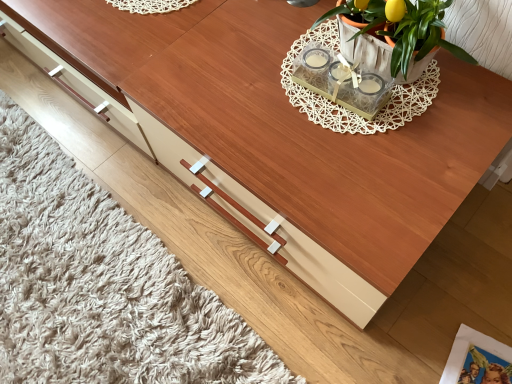
At what (x,y) coordinates should I click in order to perform the action: click on terracotta clay pot at upper right. Please return your answer as a coordinate pair (x, y). Looking at the image, I should click on (366, 46).

The width and height of the screenshot is (512, 384). Describe the element at coordinates (366, 46) in the screenshot. I see `terracotta clay pot at upper right` at that location.

What do you see at coordinates (476, 353) in the screenshot? I see `printed paper magazine at lower right` at bounding box center [476, 353].

The height and width of the screenshot is (384, 512). In order to click on printed paper magazine at lower right in this screenshot , I will do `click(476, 353)`.

This screenshot has width=512, height=384. What are the coordinates of `terracotta clay pot at upper right` in the screenshot? It's located at (366, 46).

Can you confirm if terracotta clay pot at upper right is positioned to the right of printed paper magazine at lower right?

Incorrect, terracotta clay pot at upper right is not on the right side of printed paper magazine at lower right.

Considering the positions of objects terracotta clay pot at upper right and printed paper magazine at lower right in the image provided, who is behind, terracotta clay pot at upper right or printed paper magazine at lower right?

printed paper magazine at lower right is further from the camera.

Which point is more forward, (426, 61) or (492, 354)?

The point (426, 61) is closer to the camera.

From the image's perspective, which is below, terracotta clay pot at upper right or printed paper magazine at lower right?

From the image's view, printed paper magazine at lower right is below.

From a real-world perspective, is terracotta clay pot at upper right physically located above or below printed paper magazine at lower right?

Clearly, from a real-world perspective, terracotta clay pot at upper right is above printed paper magazine at lower right.

Is terracotta clay pot at upper right wider than printed paper magazine at lower right?

A: In fact, terracotta clay pot at upper right might be narrower than printed paper magazine at lower right.

Considering the relative sizes of terracotta clay pot at upper right and printed paper magazine at lower right in the image provided, is terracotta clay pot at upper right shorter than printed paper magazine at lower right?

Incorrect, the height of terracotta clay pot at upper right does not fall short of that of printed paper magazine at lower right.

Between terracotta clay pot at upper right and printed paper magazine at lower right, which one has smaller size?

With smaller size is printed paper magazine at lower right.

Based on the photo, is terracotta clay pot at upper right situated inside printed paper magazine at lower right or outside?

terracotta clay pot at upper right is outside printed paper magazine at lower right.

Would you consider terracotta clay pot at upper right to be distant from printed paper magazine at lower right?

Actually, terracotta clay pot at upper right and printed paper magazine at lower right are a little close together.

Is terracotta clay pot at upper right facing away from printed paper magazine at lower right?

No, terracotta clay pot at upper right is not facing the opposite direction of printed paper magazine at lower right.

Consider the image. How many degrees apart are the facing directions of terracotta clay pot at upper right and printed paper magazine at lower right?

77.4 degrees.

In the image, there is a printed paper magazine at lower right. Where is `flowerpot above it (from the image's perspective)`? The width and height of the screenshot is (512, 384). flowerpot above it (from the image's perspective) is located at coordinates (366, 46).

Does printed paper magazine at lower right appear on the right side of terracotta clay pot at upper right?

Indeed, printed paper magazine at lower right is positioned on the right side of terracotta clay pot at upper right.

Considering the positions of objects printed paper magazine at lower right and terracotta clay pot at upper right in the image provided, who is in front, printed paper magazine at lower right or terracotta clay pot at upper right?

Positioned in front is terracotta clay pot at upper right.

Is point (464, 343) positioned after point (364, 39)?

Yes, point (464, 343) is farther from viewer.

From the image's perspective, between printed paper magazine at lower right and terracotta clay pot at upper right, who is located below?

printed paper magazine at lower right appears lower in the image.

From a real-world perspective, which object stands above the other?

In real-world perspective, terracotta clay pot at upper right is above.

Considering the sizes of printed paper magazine at lower right and terracotta clay pot at upper right in the image, is printed paper magazine at lower right wider or thinner than terracotta clay pot at upper right?

printed paper magazine at lower right is wider than terracotta clay pot at upper right.

Can you confirm if printed paper magazine at lower right is taller than terracotta clay pot at upper right?

In fact, printed paper magazine at lower right may be shorter than terracotta clay pot at upper right.

Considering the sizes of objects printed paper magazine at lower right and terracotta clay pot at upper right in the image provided, who is smaller, printed paper magazine at lower right or terracotta clay pot at upper right?

printed paper magazine at lower right is smaller.

Is printed paper magazine at lower right spatially inside terracotta clay pot at upper right, or outside of it?

printed paper magazine at lower right is not inside terracotta clay pot at upper right, it's outside.

Is printed paper magazine at lower right not close to terracotta clay pot at upper right?

No, there isn't a large distance between printed paper magazine at lower right and terracotta clay pot at upper right.

Is printed paper magazine at lower right turned away from terracotta clay pot at upper right?

That's not correct — printed paper magazine at lower right is not looking away from terracotta clay pot at upper right.

Can you tell me how much printed paper magazine at lower right and terracotta clay pot at upper right differ in facing direction?

The angle between the facing direction of printed paper magazine at lower right and the facing direction of terracotta clay pot at upper right is 77.4 degrees.

I want to click on magazine behind the terracotta clay pot at upper right, so click(x=476, y=353).

I want to click on magazine on the right of terracotta clay pot at upper right, so click(x=476, y=353).

At what (x,y) coordinates should I click in order to perform the action: click on magazine behind the terracotta clay pot at upper right. Please return your answer as a coordinate pair (x, y). This screenshot has width=512, height=384. Looking at the image, I should click on (476, 353).